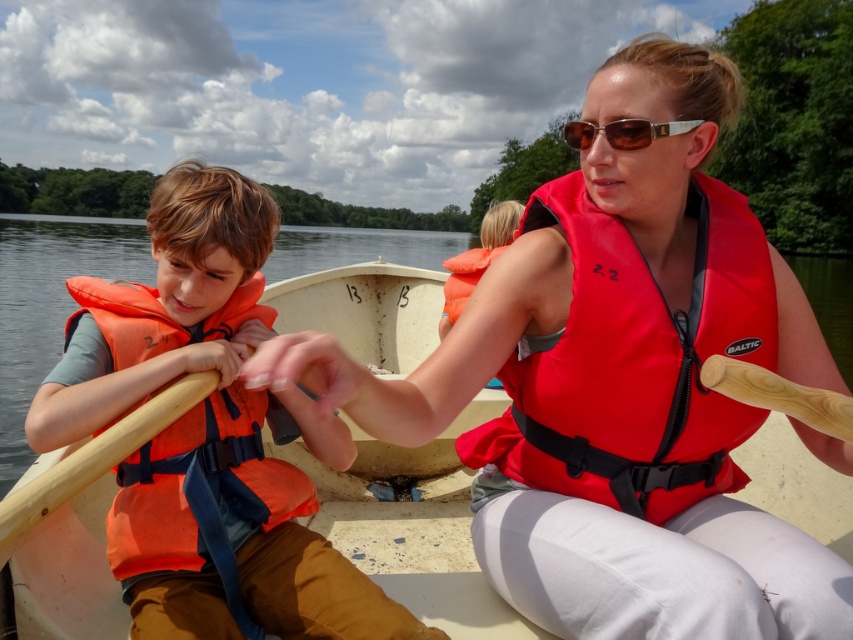
Question: Is matte red life vest at center further to the viewer compared to orange fabric life jacket at left?

Choices:
 (A) yes
 (B) no

Answer: (B)

Question: Which object is positioned farthest from the orange fabric life jacket at left?

Choices:
 (A) orange life vest at left
 (B) orange fabric life jacket at center

Answer: (B)

Question: Does red nylon life jacket at center have a greater width compared to orange fabric life jacket at center?

Choices:
 (A) yes
 (B) no

Answer: (A)

Question: Which is farther from the matte red life vest at center?

Choices:
 (A) orange fabric life jacket at center
 (B) red nylon life jacket at center
 (C) brown metallic sunglasses at center
 (D) orange life vest at left

Answer: (A)

Question: Considering the real-world distances, which object is farthest from the red nylon life jacket at center?

Choices:
 (A) matte red life vest at center
 (B) orange fabric life jacket at left
 (C) brown metallic sunglasses at center

Answer: (B)

Question: Does orange life vest at left appear on the left side of orange fabric life jacket at center?

Choices:
 (A) no
 (B) yes

Answer: (B)